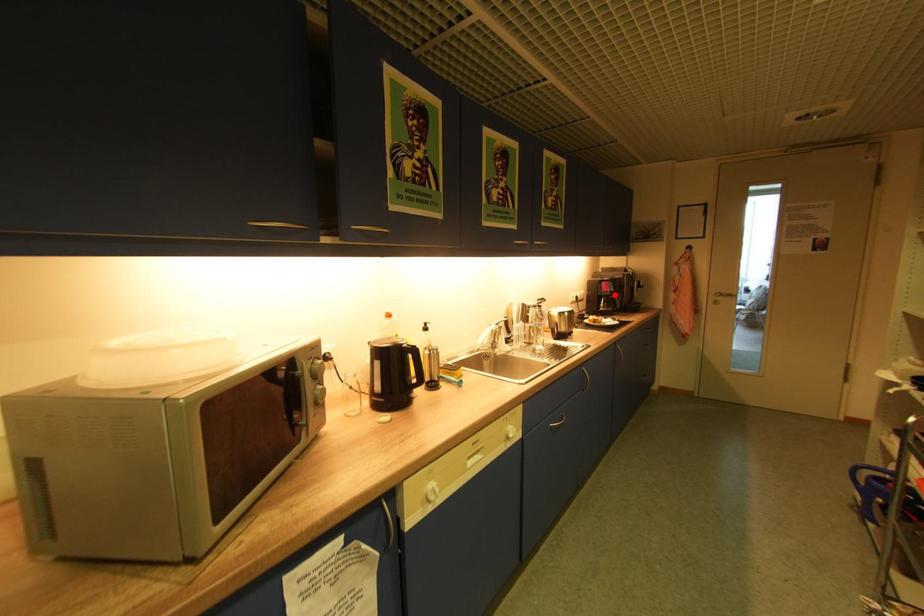
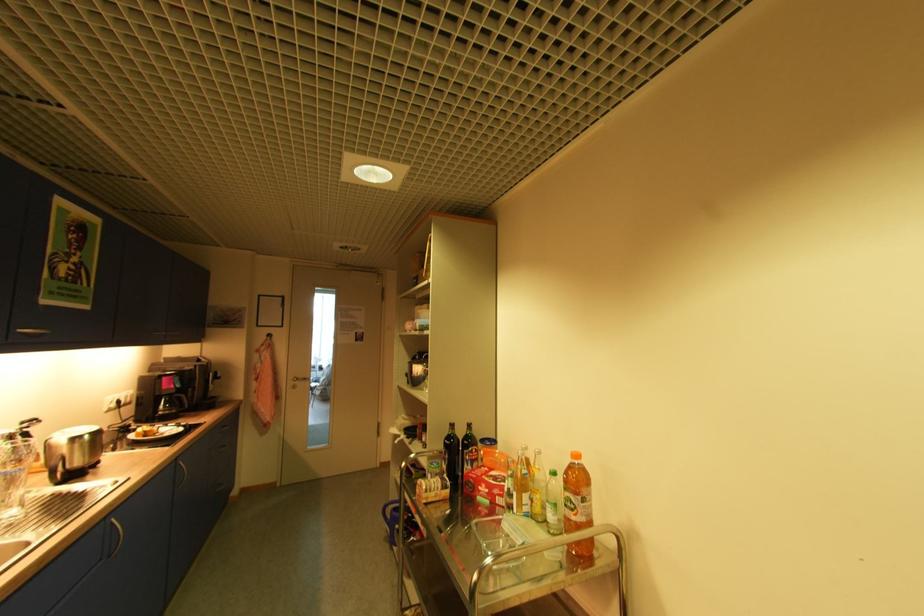
The point at the highlighted location is marked in the first image. Where is the corresponding point in the second image?

(178, 392)